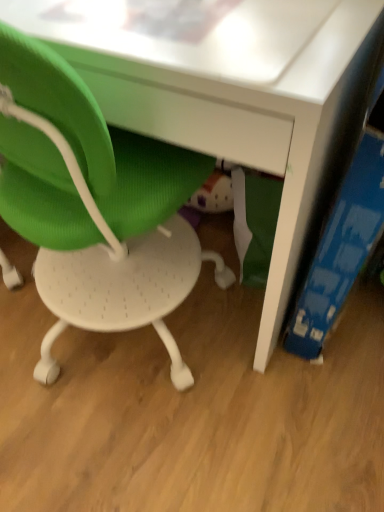
I want to click on vacant space that is to the left of blue cardboard book at right, so click(x=226, y=330).